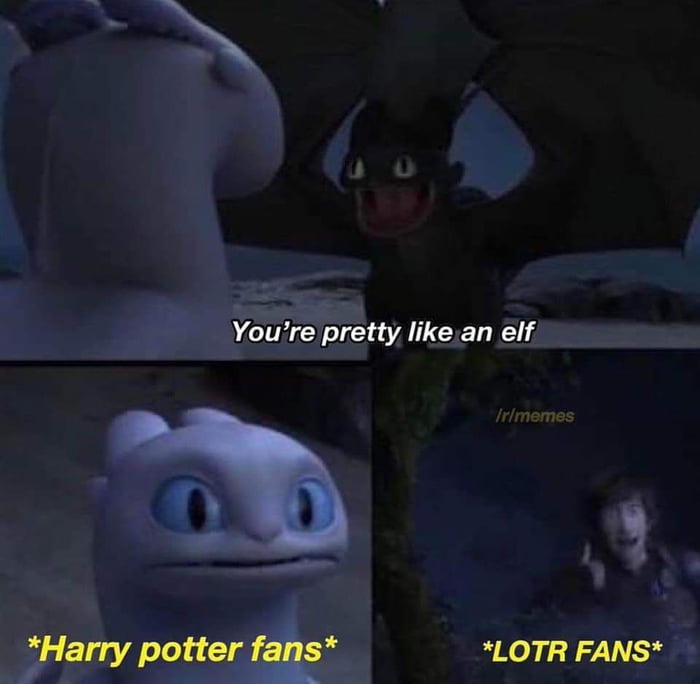
Where is `large box`? large box is located at coordinates (97, 142), (573, 204).